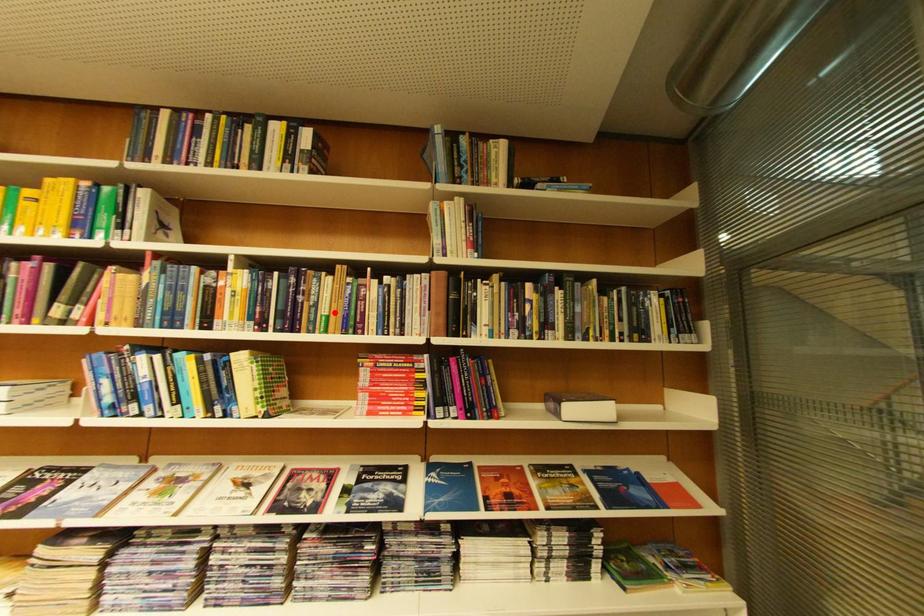
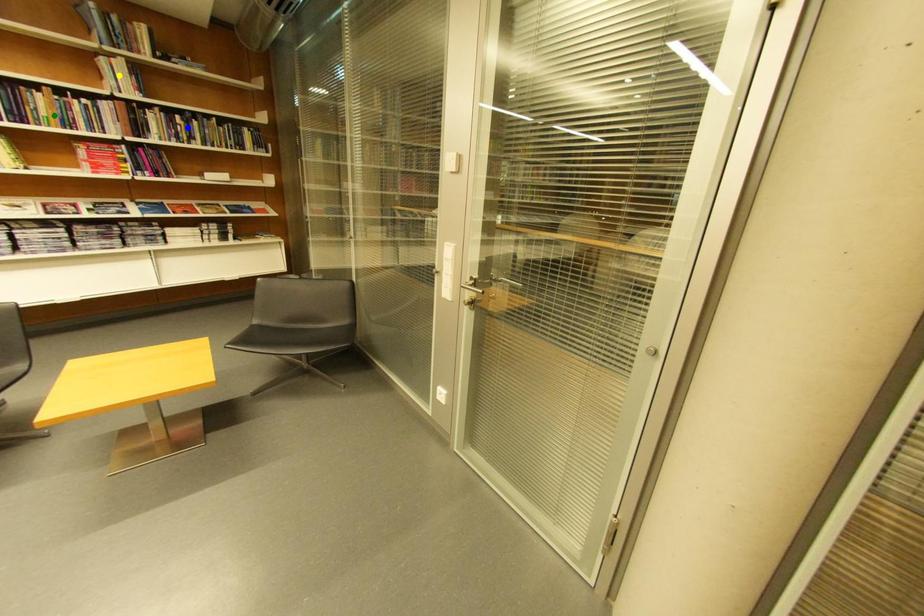
Question: I am providing you with two images of the same scene from different viewpoints. A red point is marked on the first image. You are given multiple points on the second image. Which mark in image 2 goes with the point in image 1?

Choices:
 (A) green point
 (B) blue point
 (C) yellow point

Answer: (A)